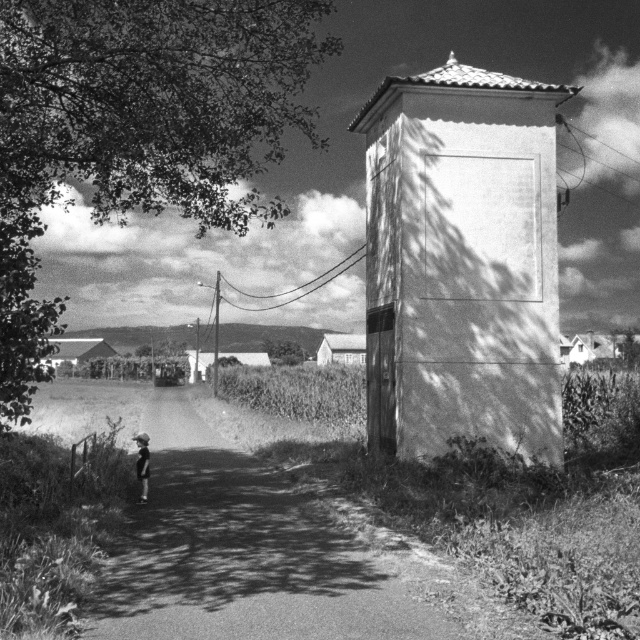
Question: Is dark green leafy tree at upper left above dirt road at center?

Choices:
 (A) yes
 (B) no

Answer: (A)

Question: Among these objects, which one is nearest to the camera?

Choices:
 (A) light skin tone human at center
 (B) dirt road at center
 (C) smooth concrete water tower at center
 (D) dark green leafy tree at upper left

Answer: (B)

Question: Among these points, which one is farthest from the camera?

Choices:
 (A) (232, 52)
 (B) (522, 371)
 (C) (141, 484)

Answer: (A)

Question: Does dark green leafy tree at upper left have a greater width compared to dirt road at center?

Choices:
 (A) yes
 (B) no

Answer: (A)

Question: Which object appears closest to the camera in this image?

Choices:
 (A) smooth concrete water tower at center
 (B) dirt road at center
 (C) light skin tone human at center
 (D) dark green leafy tree at upper left

Answer: (B)

Question: Is the position of dark green leafy tree at upper left more distant than that of light skin tone human at center?

Choices:
 (A) no
 (B) yes

Answer: (A)